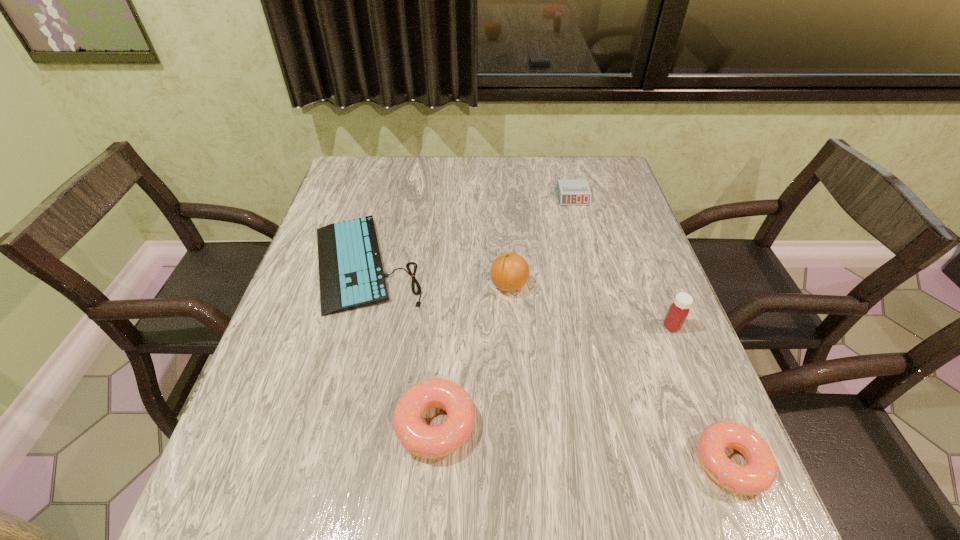
Where is `object present at the far right corner`? The width and height of the screenshot is (960, 540). object present at the far right corner is located at coordinates (570, 192).

Find the location of `object present at the near right corner`. object present at the near right corner is located at coordinates (760, 472).

Identify the location of vacant region at the far edge. (430, 165).

Where is `vacant space at the near edge of the desktop`? vacant space at the near edge of the desktop is located at coordinates [348, 422].

Identify the location of free location at the left edge. (301, 360).

You are a GUI agent. You are given a task and a screenshot of the screen. Output one action in this format:
    pyautogui.click(x=<x>, y=<y>)
    Task: Click on the free space at the right edge of the desktop
    The height and width of the screenshot is (540, 960).
    Given the screenshot: What is the action you would take?
    pyautogui.click(x=615, y=204)

Locate an element on the screen. free space at the far left corner of the desktop is located at coordinates (343, 183).

Identify the location of unoccupied position between the computer keyboard and the right doughnut. This screenshot has height=540, width=960. (547, 363).

The height and width of the screenshot is (540, 960). I want to click on free spot between the medicine and the right doughnut, so click(701, 394).

The height and width of the screenshot is (540, 960). What are the coordinates of `vacant region between the alarm clock and the fourth object from right to left` in the screenshot? It's located at (541, 241).